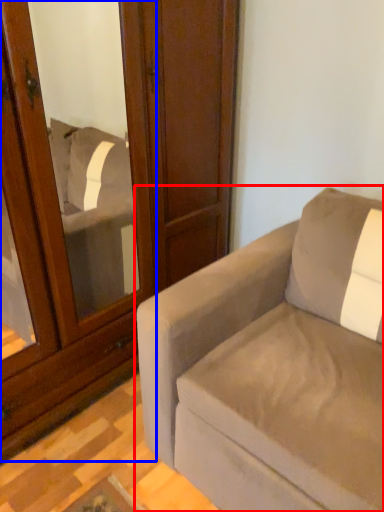
Question: Which of the following is the farthest to the observer, studio couch (highlighted by a red box) or screen door (highlighted by a blue box)?

Choices:
 (A) studio couch
 (B) screen door

Answer: (B)